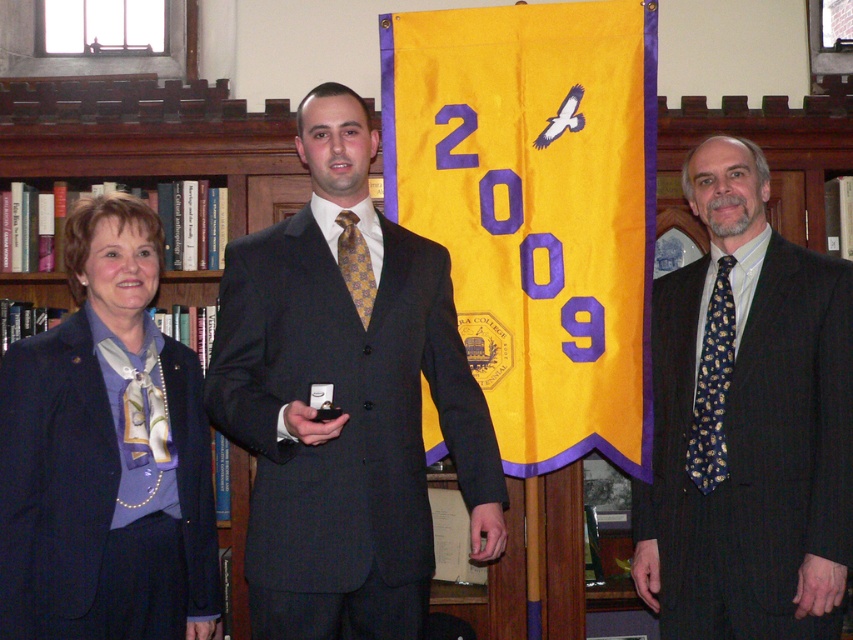
You are standing in the library and want to locate the dark gray suit at right. According to the coordinates provided, where should you look?

You should look at point 0.661 on the x axis and 0.877 on the y axis to find the dark gray suit at right.